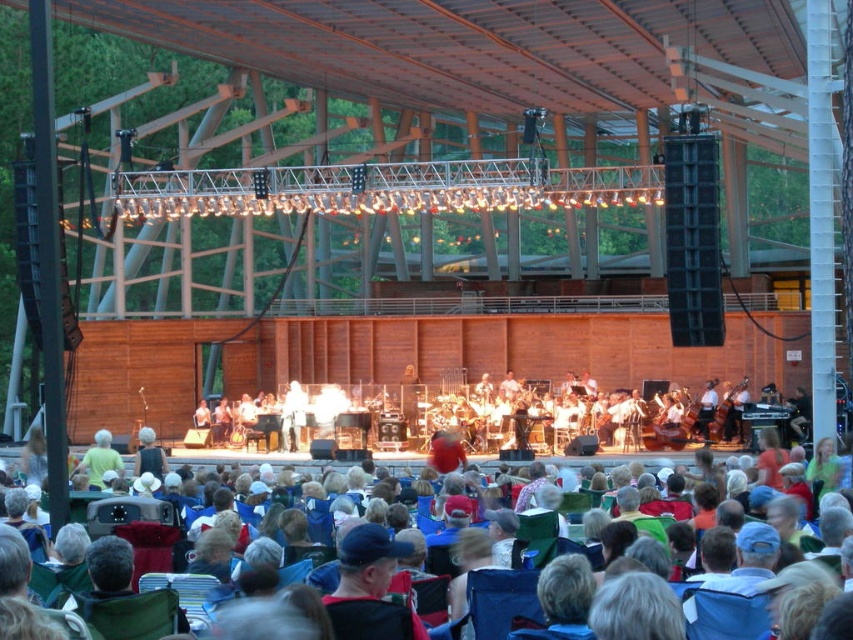
Question: Which point is closer to the camera taking this photo?

Choices:
 (A) (90, 451)
 (B) (758, 634)

Answer: (B)

Question: Does blue fabric chairs at center have a greater width compared to light green fabric at center?

Choices:
 (A) no
 (B) yes

Answer: (B)

Question: Which object is closer to the camera taking this photo?

Choices:
 (A) blue fabric chairs at center
 (B) light green fabric at center

Answer: (A)

Question: Is blue fabric chairs at center to the right of light green fabric at center from the viewer's perspective?

Choices:
 (A) yes
 (B) no

Answer: (A)

Question: Is blue fabric chairs at center wider than light green fabric at center?

Choices:
 (A) yes
 (B) no

Answer: (A)